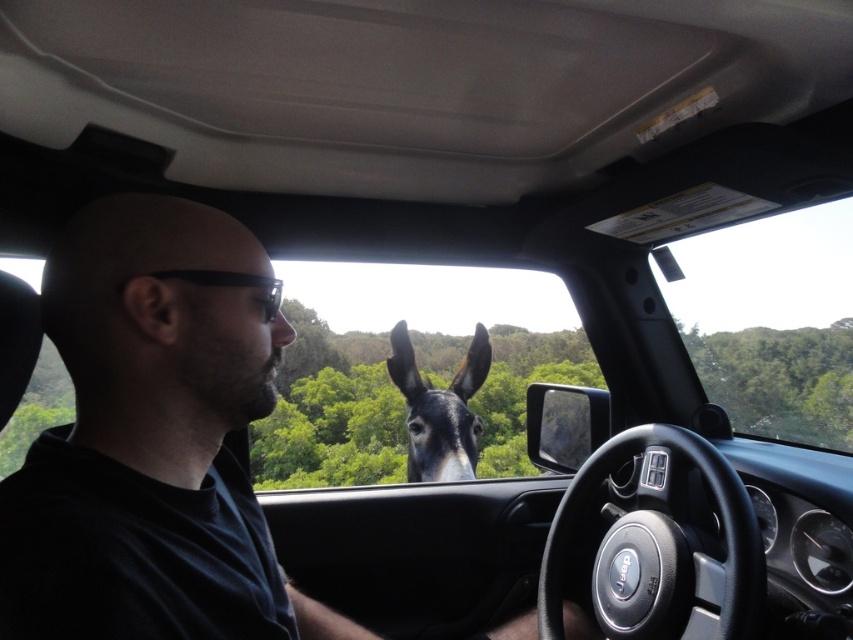
Question: Does black matte shirt at center have a smaller size compared to black plastic glasses at left?

Choices:
 (A) yes
 (B) no

Answer: (B)

Question: Does black matte shirt at center lie behind black glossy donkey at center?

Choices:
 (A) no
 (B) yes

Answer: (A)

Question: Can you confirm if black matte shirt at center is wider than black plastic glasses at left?

Choices:
 (A) no
 (B) yes

Answer: (B)

Question: Which point appears closest to the camera in this image?

Choices:
 (A) (566, 621)
 (B) (154, 272)
 (C) (459, 477)

Answer: (B)

Question: Which is farther from the black plastic glasses at left?

Choices:
 (A) black glossy donkey at center
 (B) black matte shirt at center

Answer: (A)

Question: Among these points, which one is farthest from the camera?

Choices:
 (A) (207, 269)
 (B) (56, 620)

Answer: (A)